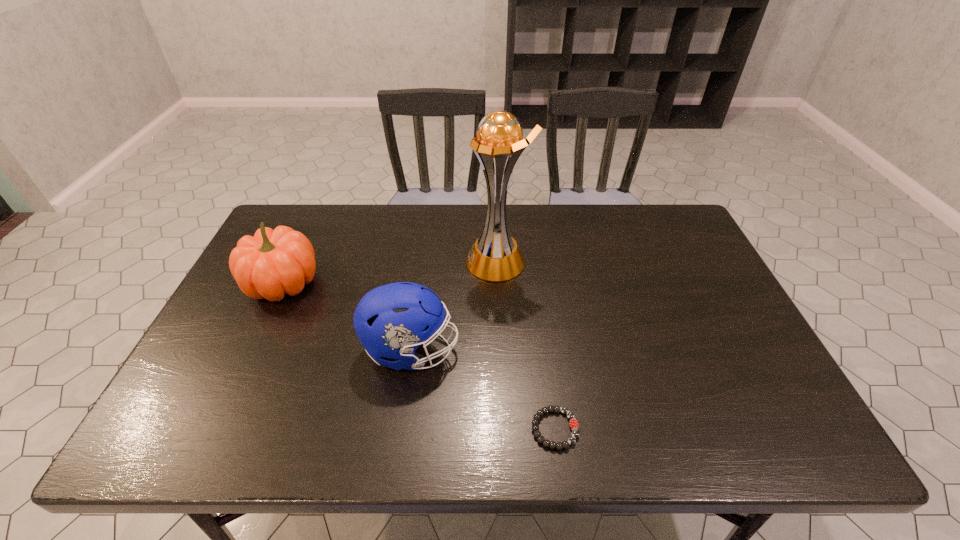
You are a GUI agent. You are given a task and a screenshot of the screen. Output one action in this format:
    pyautogui.click(x=<x>, y=<y>)
    Task: Click on the blank space located on the face guard of the third farthest object
    
    Given the screenshot: What is the action you would take?
    pyautogui.click(x=543, y=350)

The width and height of the screenshot is (960, 540). What are the coordinates of `blank area located on the right of the shortest object` in the screenshot? It's located at (709, 429).

This screenshot has height=540, width=960. I want to click on object at the far edge, so click(495, 256).

Identify the location of object that is at the near edge. (573, 422).

Locate an element on the screen. The image size is (960, 540). object that is positioned at the left edge is located at coordinates (273, 263).

In the image, there is a desktop. At what (x,y) coordinates should I click in order to perform the action: click on vacant space at the far edge. Please return your answer as a coordinate pair (x, y). The height and width of the screenshot is (540, 960). Looking at the image, I should click on (450, 209).

Find the location of a particular element. free location at the near edge of the desktop is located at coordinates (532, 443).

You are a GUI agent. You are given a task and a screenshot of the screen. Output one action in this format:
    pyautogui.click(x=<x>, y=<y>)
    Task: Click on the free space at the left edge
    
    Given the screenshot: What is the action you would take?
    pyautogui.click(x=249, y=388)

Locate an element on the screen. The width and height of the screenshot is (960, 540). free region at the right edge is located at coordinates (701, 267).

The width and height of the screenshot is (960, 540). In order to click on vacant space at the near left corner of the desktop in this screenshot , I will do `click(167, 413)`.